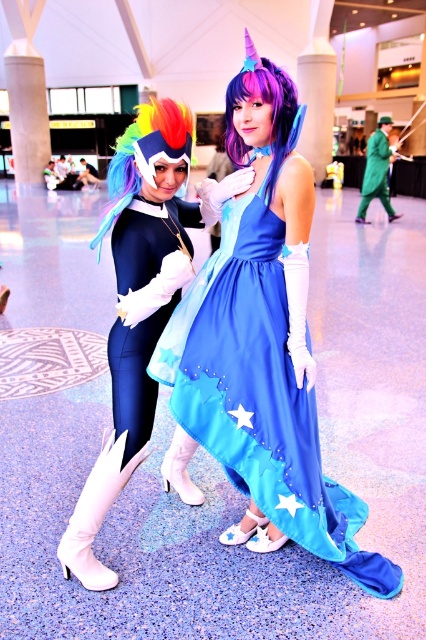
Question: Which is farther from the rainbow hair at left?

Choices:
 (A) purple silky wig at center
 (B) blue satin dress at center
 (C) matte black bodysuit at left

Answer: (B)

Question: From the image, what is the correct spatial relationship of matte black bodysuit at center in relation to purple silky wig at center?

Choices:
 (A) right
 (B) left

Answer: (B)

Question: Does matte black bodysuit at center have a lesser width compared to purple silky wig at center?

Choices:
 (A) yes
 (B) no

Answer: (B)

Question: Which object appears farthest from the camera in this image?

Choices:
 (A) purple silky wig at center
 (B) blue satin dress at center
 (C) matte black bodysuit at left

Answer: (B)

Question: Which point appears farthest from the camera in this image?

Choices:
 (A) (256, 291)
 (B) (178, 192)
 (C) (131, 236)

Answer: (B)

Question: Considering the relative positions of matte black bodysuit at left and matte black bodysuit at center in the image provided, where is matte black bodysuit at left located with respect to matte black bodysuit at center?

Choices:
 (A) above
 (B) below

Answer: (B)